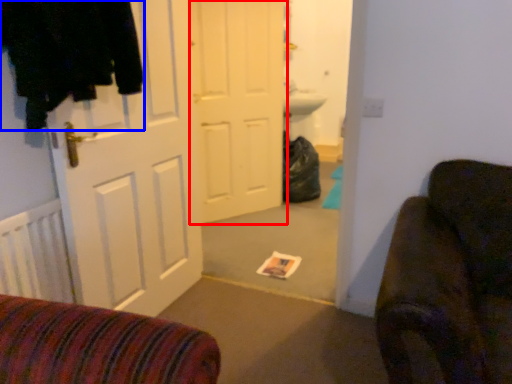
Question: Which object is further to the camera taking this photo, door (highlighted by a red box) or clothing (highlighted by a blue box)?

Choices:
 (A) door
 (B) clothing

Answer: (A)